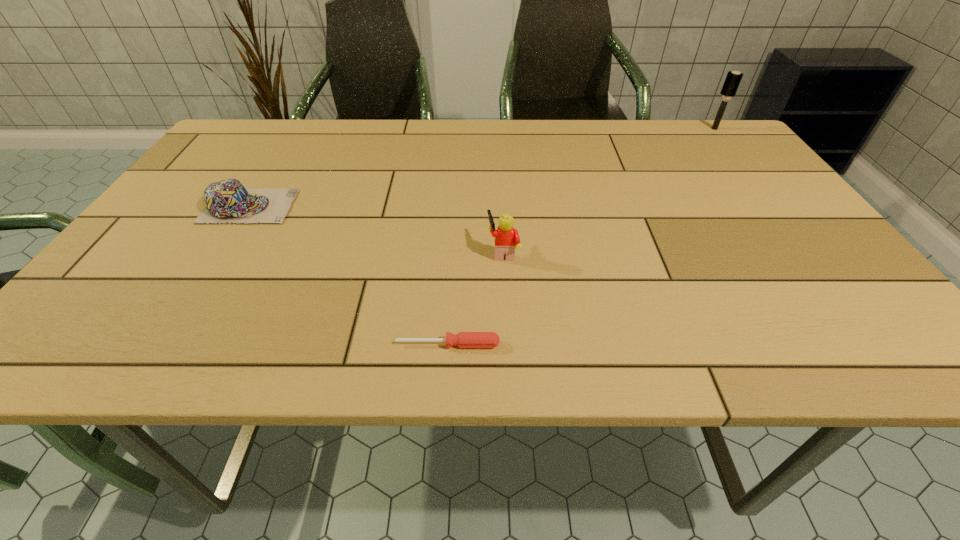
Locate an element on the screen. The width and height of the screenshot is (960, 540). vacant position located 0.140m in front of the third farthest object with the accessory visible is located at coordinates (420, 252).

Where is `vacant region located 0.280m in front of the third farthest object with the accessory visible`? The width and height of the screenshot is (960, 540). vacant region located 0.280m in front of the third farthest object with the accessory visible is located at coordinates (352, 252).

Find the location of a particular element. vacant region located 0.110m on the front, side, and top of the third nearest object is located at coordinates (340, 206).

Identify the location of free region located on the back of the nearest object. (454, 250).

Where is `object located at the far edge`? object located at the far edge is located at coordinates (733, 79).

Where is `object that is positioned at the near edge`? The height and width of the screenshot is (540, 960). object that is positioned at the near edge is located at coordinates click(463, 339).

This screenshot has width=960, height=540. Find the location of `object located in the left edge section of the desktop`. object located in the left edge section of the desktop is located at coordinates (227, 200).

This screenshot has width=960, height=540. Find the location of `object that is at the right edge`. object that is at the right edge is located at coordinates (733, 79).

Locate an element on the screen. The width and height of the screenshot is (960, 540). object present at the far right corner is located at coordinates (733, 79).

The image size is (960, 540). Identify the location of blank space at the far edge of the desktop. click(x=380, y=139).